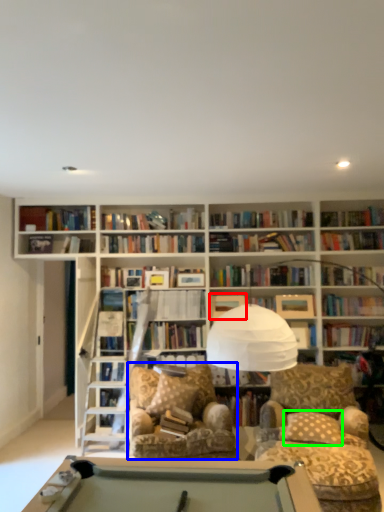
Question: Based on their relative distances, which object is nearer to paperback book (highlighted by a red box)? Choose from swivel chair (highlighted by a blue box) and pillow (highlighted by a green box).

Choices:
 (A) swivel chair
 (B) pillow

Answer: (A)